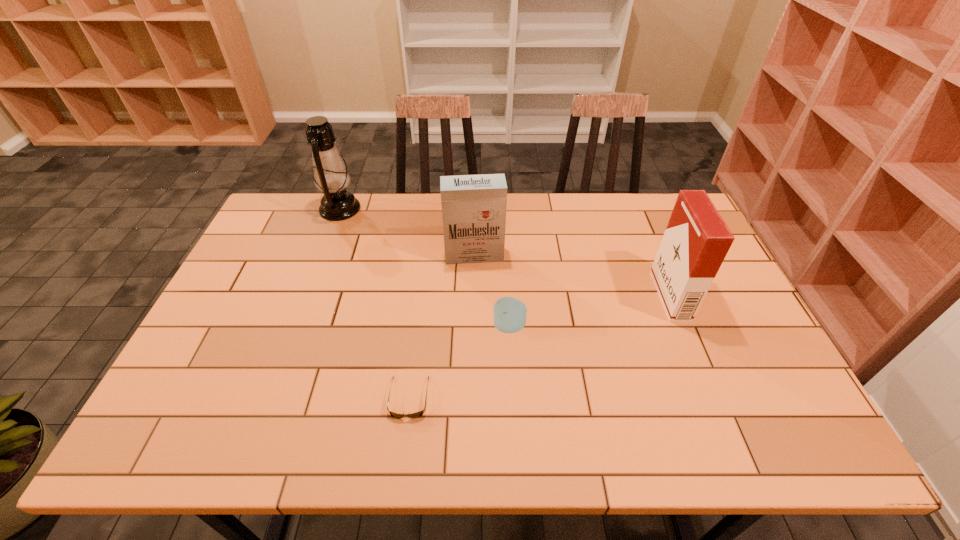
This screenshot has height=540, width=960. What are the coordinates of `free space between the rightmost object and the farthest object` in the screenshot? It's located at (505, 252).

Image resolution: width=960 pixels, height=540 pixels. I want to click on free space between the rightmost object and the apple, so click(x=589, y=311).

The width and height of the screenshot is (960, 540). What are the coordinates of `free space between the fourth tallest object and the left cigarette case` in the screenshot? It's located at (492, 291).

At what (x,y) coordinates should I click in order to perform the action: click on free space between the second object from left to right and the fourth nearest object. Please return your answer as a coordinate pair (x, y). This screenshot has height=540, width=960. Looking at the image, I should click on (442, 326).

Where is `unoccupied area between the rightmost object and the second shortest object`? unoccupied area between the rightmost object and the second shortest object is located at coordinates (589, 311).

The width and height of the screenshot is (960, 540). Find the location of `free space between the apple and the left cigarette case`. free space between the apple and the left cigarette case is located at coordinates (492, 291).

At what (x,y) coordinates should I click in order to perform the action: click on object that stands as the closest to the sunglasses. Please return your answer as a coordinate pair (x, y). The width and height of the screenshot is (960, 540). Looking at the image, I should click on (509, 315).

Identify the location of object identified as the fourth closest to the sunglasses. (696, 241).

I want to click on vacant region that satisfies the following two spatial constraints: 1. on the front side of the farther cigarette case; 2. on the right side of the apple, so click(x=473, y=327).

Locate an element on the screen. The height and width of the screenshot is (540, 960). vacant point that satisfies the following two spatial constraints: 1. on the front-facing side of the right cigarette case; 2. on the front side of the apple is located at coordinates (683, 327).